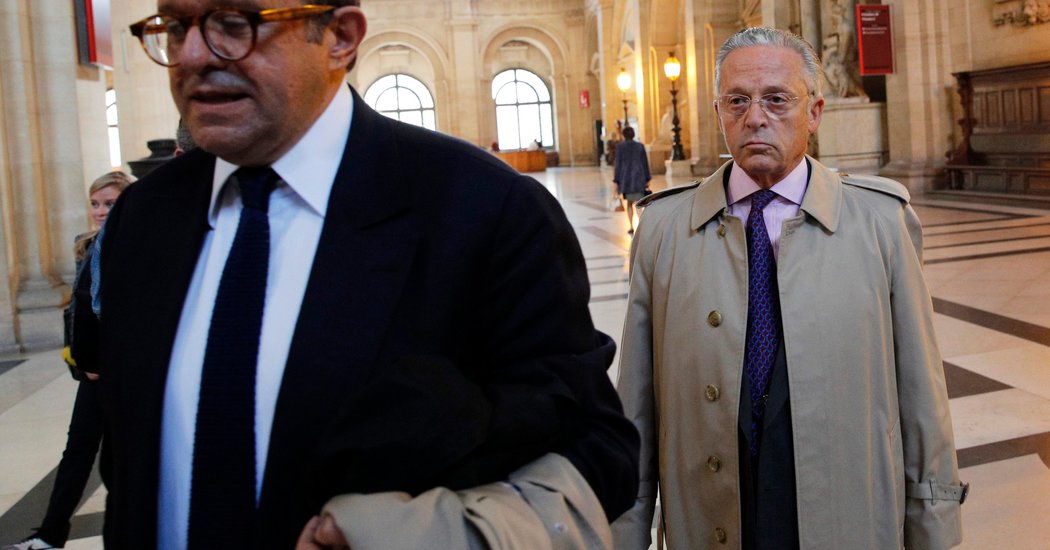
Find the location of a particular element. The image size is (1050, 550). window is located at coordinates (111, 122), (392, 106), (528, 106).